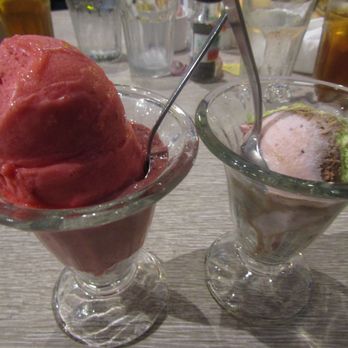
The image size is (348, 348). Find the location of `glass`. glass is located at coordinates (94, 303), (240, 277), (282, 35), (156, 33), (92, 25), (329, 50).